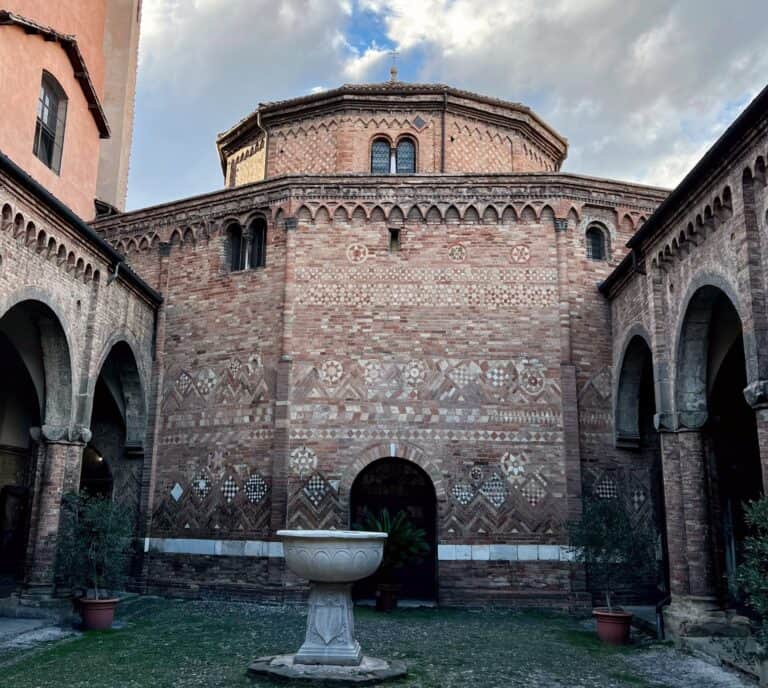
I want to click on horizontal white stripe on wall left side, so click(x=212, y=548).